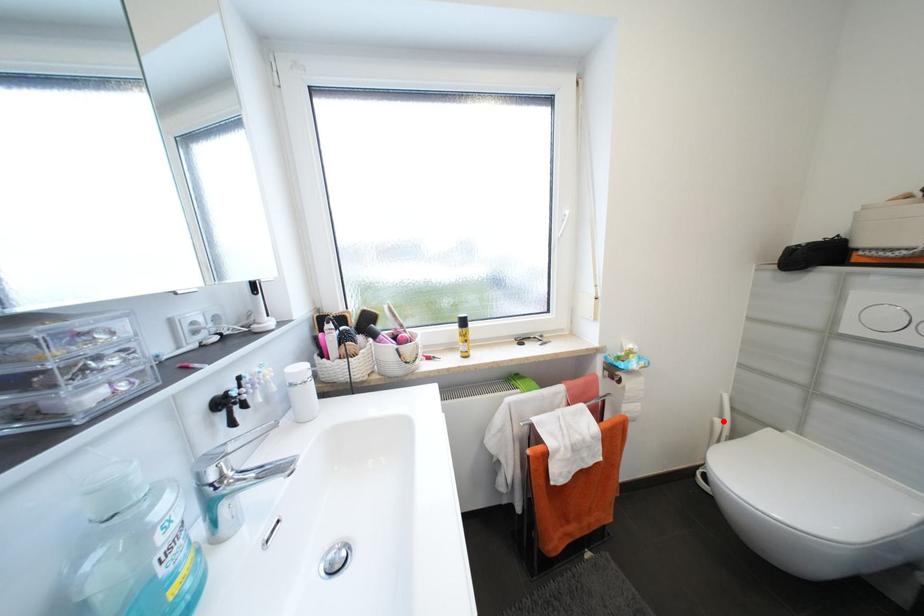
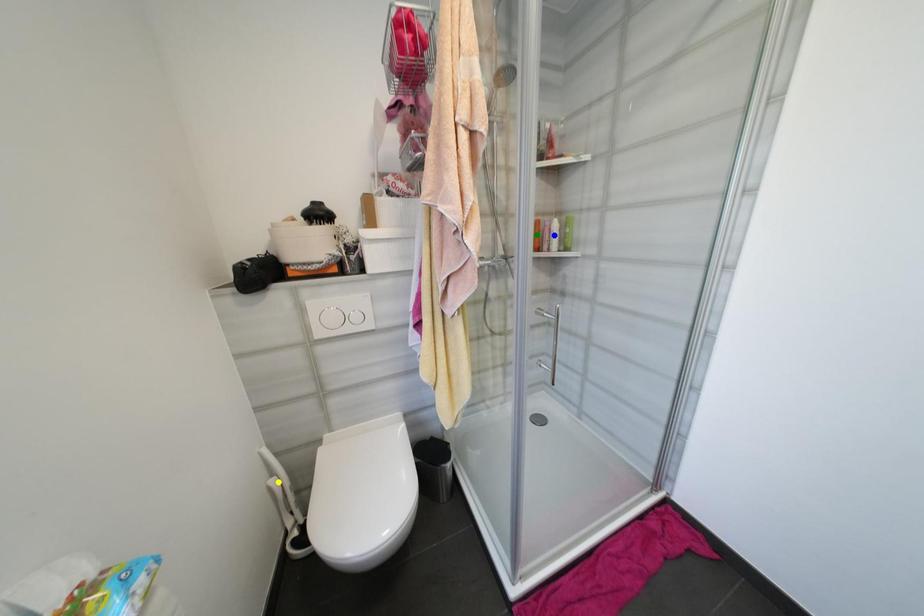
Question: I am providing you with two images of the same scene from different viewpoints. A red point is marked on the first image. You are given multiple points on the second image. Can you choose the point in image 2 that corresponds to the point in image 1?

Choices:
 (A) blue point
 (B) yellow point
 (C) green point

Answer: (B)